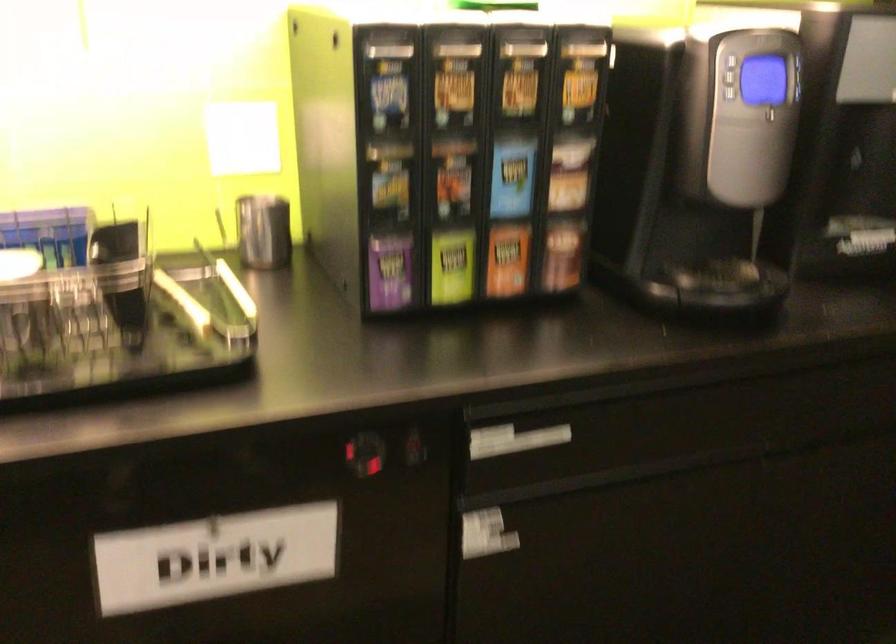
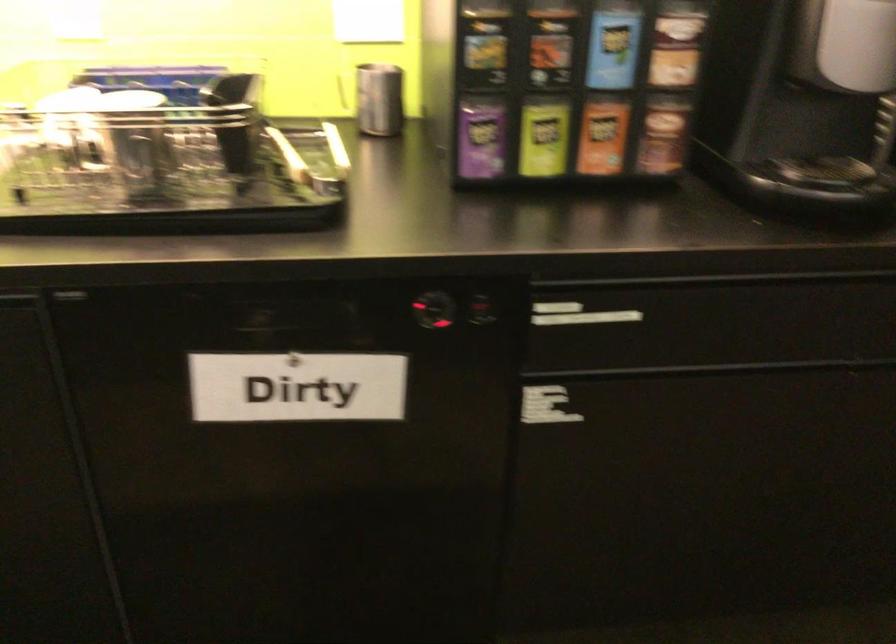
The point at [512,171] is marked in the first image. Where is the corresponding point in the second image?

(613, 44)